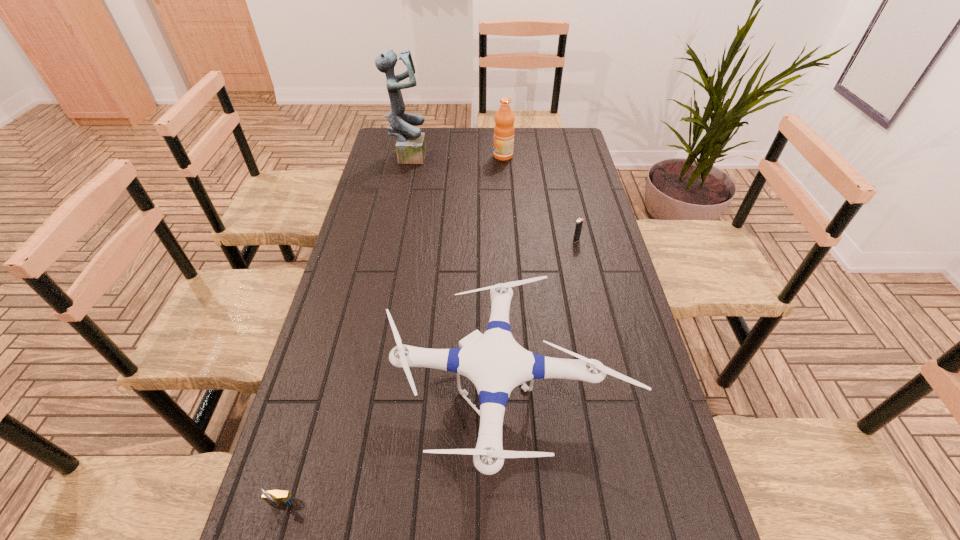
Select which object is the second closest to the sculpture. Please provide its 2D coordinates. Your answer should be formatted as a tuple, i.e. [(x, y)], where the tuple contains the x and y coordinates of a point satisfying the conditions above.

[(579, 223)]

I want to click on object that ranks as the second closest to the drone, so click(x=579, y=223).

Identify the location of free space that satisfies the following two spatial constraints: 1. on the label side of the second tallest object; 2. on the right side of the igniter. (509, 240).

Locate an element on the screen. Image resolution: width=960 pixels, height=540 pixels. vacant area in the image that satisfies the following two spatial constraints: 1. on the label side of the fruit juice; 2. on the side with the combination dials of the padlock is located at coordinates (527, 506).